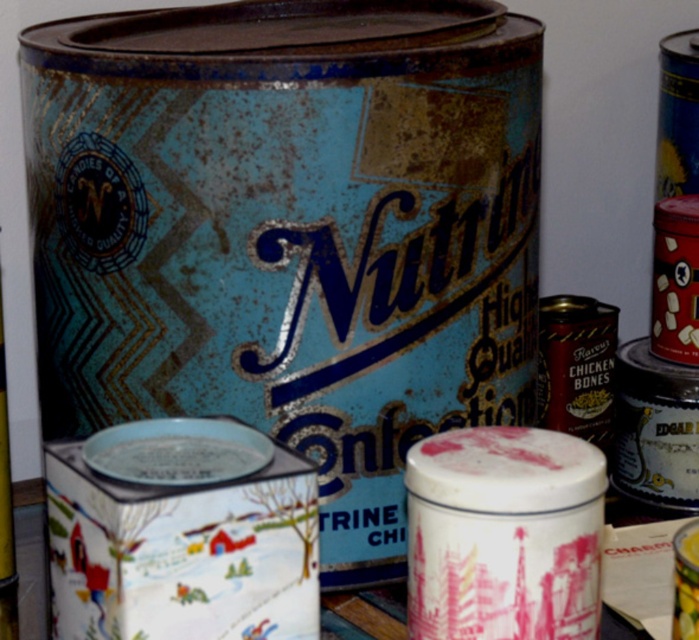
Is point (675, 580) positioned behind point (13, 556)?

No, it is in front of (13, 556).

How distant is metallic gold beer can at upper right from rusty metal can at left?

metallic gold beer can at upper right and rusty metal can at left are 17.70 inches apart from each other.

Who is more forward, (691, 600) or (1, 330)?

Positioned in front is point (691, 600).

Image resolution: width=699 pixels, height=640 pixels. Identify the location of metallic gold beer can at upper right. (684, 582).

Which is more to the left, shiny metallic can at right or metallic gold beer can at upper right?

metallic gold beer can at upper right

Find the location of a particular element. The height and width of the screenshot is (640, 699). shiny metallic can at right is located at coordinates (675, 280).

Image resolution: width=699 pixels, height=640 pixels. What are the coordinates of `shiny metallic can at right` in the screenshot? It's located at (675, 280).

Is point (565, 417) farther from camera compared to point (1, 484)?

Yes, point (565, 417) is behind point (1, 484).

Who is shorter, shiny gold can at center or rusty metal can at left?

Standing shorter between the two is shiny gold can at center.

Image resolution: width=699 pixels, height=640 pixels. What do you see at coordinates (576, 365) in the screenshot?
I see `shiny gold can at center` at bounding box center [576, 365].

The width and height of the screenshot is (699, 640). I want to click on shiny gold can at center, so click(x=576, y=365).